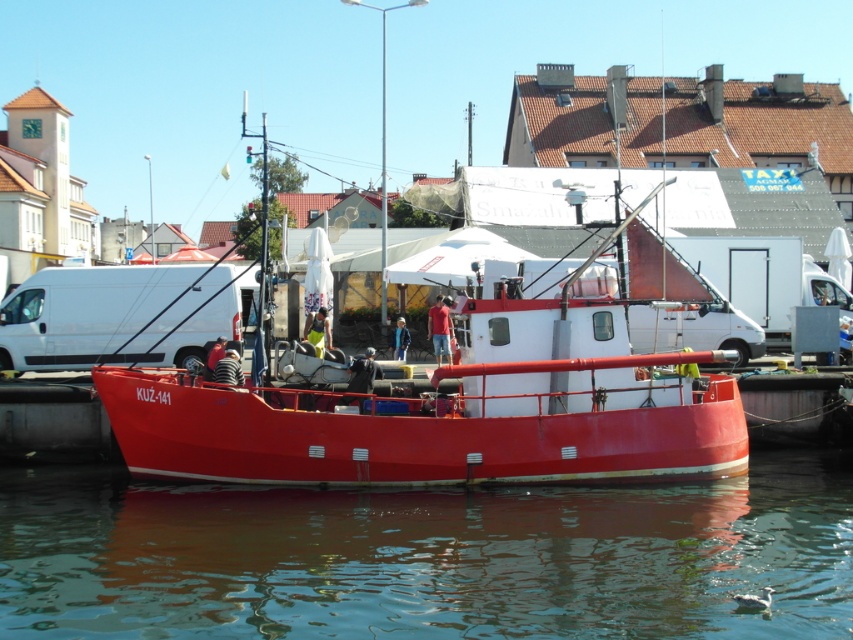
Question: Estimate the real-world distances between objects in this image. Which object is farther from the transparent water at lower center?

Choices:
 (A) white matte van at center
 (B) metallic red boat at center

Answer: (A)

Question: Is metallic red boat at center to the right of white matte van at center from the viewer's perspective?

Choices:
 (A) no
 (B) yes

Answer: (B)

Question: Does transparent water at lower center have a greater width compared to metallic red boat at center?

Choices:
 (A) yes
 (B) no

Answer: (A)

Question: Which point is farther to the camera?

Choices:
 (A) metallic red boat at center
 (B) transparent water at lower center

Answer: (A)

Question: Which of the following is the closest to the observer?

Choices:
 (A) (55, 323)
 (B) (614, 230)
 (C) (428, 612)

Answer: (C)

Question: Is metallic red boat at center thinner than white matte van at center?

Choices:
 (A) no
 (B) yes

Answer: (A)